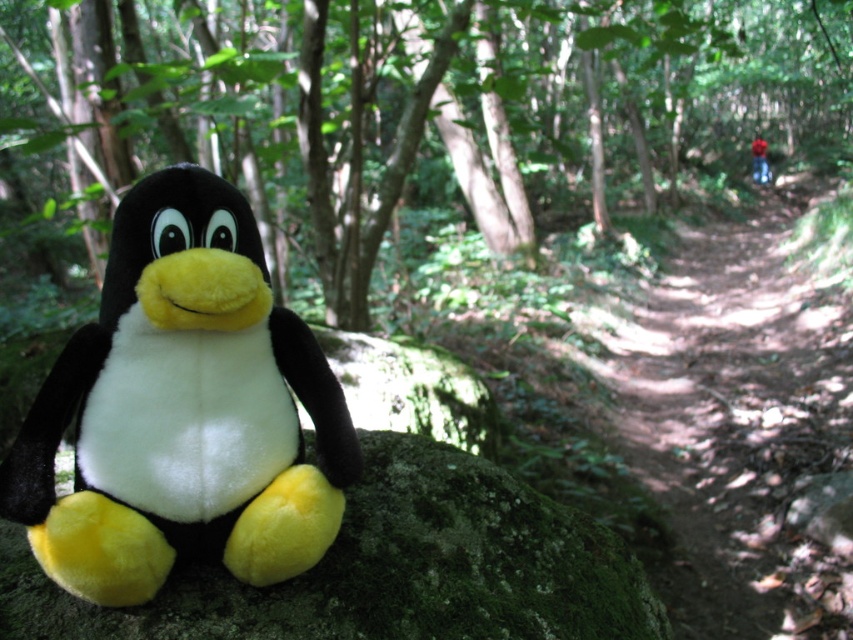
Does point (224, 250) lie behind point (837, 371)?

That is False.

Does soft plush penguin at left come in front of dirt path at center?

Yes, soft plush penguin at left is closer to the viewer.

Does point (82, 573) come closer to viewer compared to point (776, 440)?

Yes, point (82, 573) is closer to viewer.

Where is `soft plush penguin at left`? soft plush penguin at left is located at coordinates (183, 410).

Can you confirm if soft plush penguin at left is smaller than green mossy rock at lower left?

Yes.

Is soft plush penguin at left behind green mossy rock at lower left?

No.

Find the location of a particular element. The height and width of the screenshot is (640, 853). soft plush penguin at left is located at coordinates (183, 410).

Which is above, dirt path at center or green mossy rock at lower left?

dirt path at center is above.

Who is more distant from viewer, [670,264] or [53,637]?

The point [670,264] is behind.

Between point (764, 268) and point (474, 611), which one is positioned in front?

Point (474, 611) is in front.

Locate an element on the screen. This screenshot has height=640, width=853. dirt path at center is located at coordinates (741, 428).